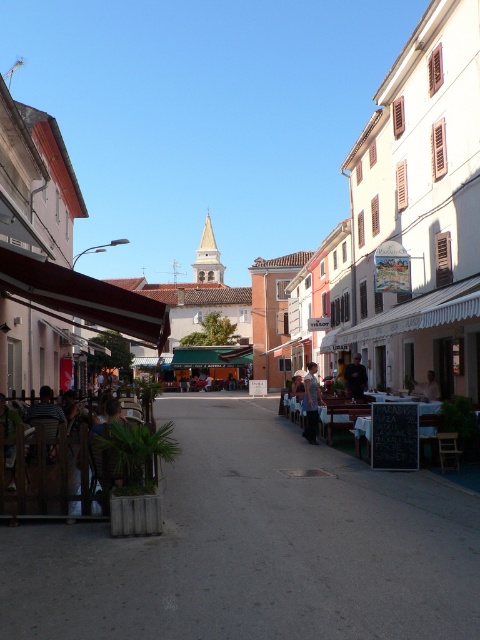
Question: Which object is farther from the camera taking this photo?

Choices:
 (A) black fabric person at center
 (B) concrete pavement at center

Answer: (A)

Question: Which point appears closest to the camera in this image?

Choices:
 (A) (432, 428)
 (B) (152, 602)
 (C) (355, 358)

Answer: (B)

Question: Can you confirm if concrete pavement at center is bigger than black chalkboard at center?

Choices:
 (A) no
 (B) yes

Answer: (B)

Question: Is black chalkboard at center further to the viewer compared to light brown leather jacket at center?

Choices:
 (A) no
 (B) yes

Answer: (A)

Question: Is concrete pavement at center closer to camera compared to black chalkboard at center?

Choices:
 (A) yes
 (B) no

Answer: (A)

Question: Which of the following is the farthest from the observer?

Choices:
 (A) concrete pavement at center
 (B) black fabric person at center
 (C) light brown leather jacket at center
 (D) white fabric chair at center

Answer: (B)